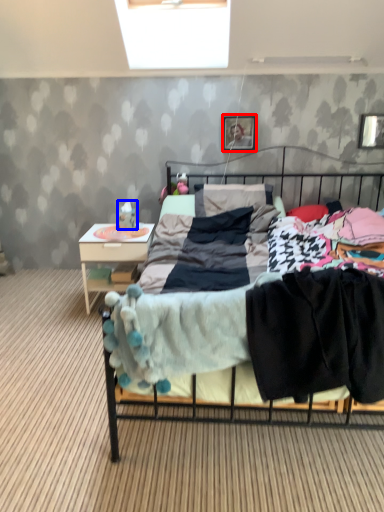
Question: Which object is closer to the camera taking this photo, picture frame (highlighted by a red box) or toy (highlighted by a blue box)?

Choices:
 (A) picture frame
 (B) toy

Answer: (B)